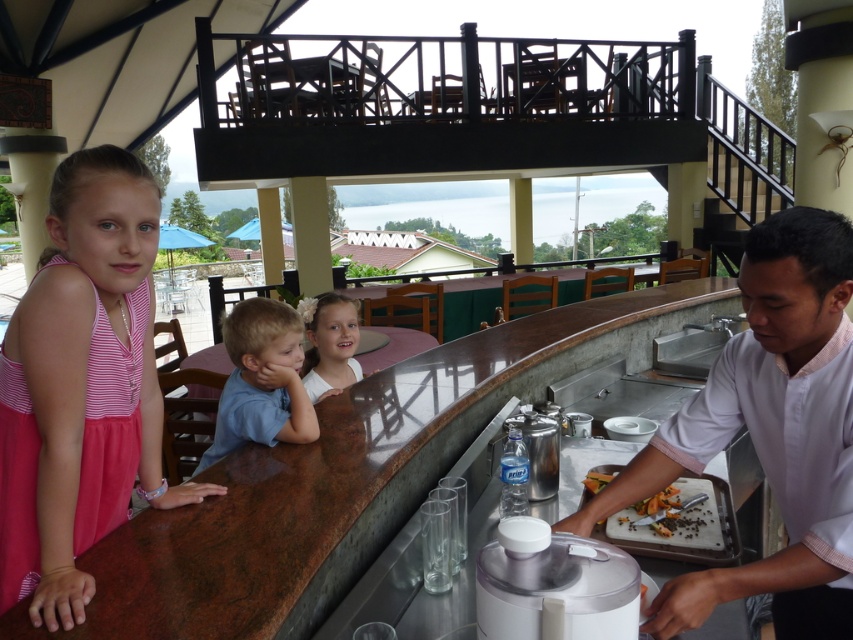
Question: Does marble countertop at center have a greater width compared to blue cotton shirt at center?

Choices:
 (A) yes
 (B) no

Answer: (A)

Question: Which object is closer to the camera taking this photo?

Choices:
 (A) white shirt at right
 (B) dark brown wooden tray at lower right
 (C) blue cotton shirt at center

Answer: (A)

Question: From the image, what is the correct spatial relationship of pink satin dress at center in relation to light brown hair at center?

Choices:
 (A) left
 (B) right

Answer: (A)

Question: Which object is the farthest from the white plastic blender at lower center?

Choices:
 (A) white shirt at right
 (B) light brown hair at center
 (C) dark brown wooden tray at lower right

Answer: (B)

Question: Is marble countertop at center closer to camera compared to light brown hair at center?

Choices:
 (A) no
 (B) yes

Answer: (B)

Question: Which point is farther from the camera taking this photo?

Choices:
 (A) (331, 358)
 (B) (602, 492)
 (C) (634, 529)

Answer: (A)